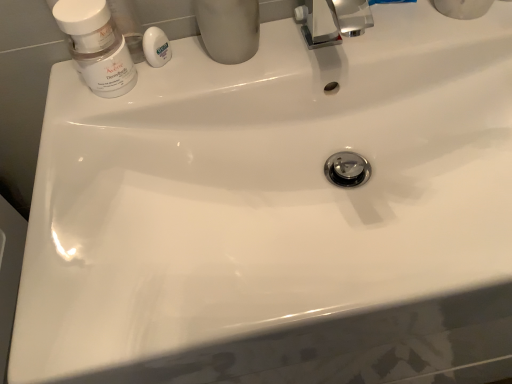
This screenshot has height=384, width=512. In order to click on white glossy soap at upper center in this screenshot , I will do `click(156, 47)`.

This screenshot has height=384, width=512. Describe the element at coordinates (228, 28) in the screenshot. I see `matte gray cup at upper center` at that location.

Consider the image. Measure the distance between matte white jar at upper left and camera.

The distance of matte white jar at upper left from camera is 17.71 inches.

I want to click on white glossy soap at upper center, so click(156, 47).

From the image's perspective, relative to matte gray cup at upper center, is white glossy soap at upper center above or below?

From the image's perspective, white glossy soap at upper center appears below matte gray cup at upper center.

Is white glossy soap at upper center touching matte gray cup at upper center?

Yes, the surface of white glossy soap at upper center is in contact with matte gray cup at upper center.

Considering the positions of points (170, 56) and (243, 9), is point (170, 56) closer to camera compared to point (243, 9)?

No.

Looking at the image, does matte white jar at upper left seem bigger or smaller compared to white glossy soap at upper center?

In the image, matte white jar at upper left appears to be larger than white glossy soap at upper center.

Is matte white jar at upper left taller or shorter than white glossy soap at upper center?

Clearly, matte white jar at upper left is taller compared to white glossy soap at upper center.

Considering the positions of objects matte white jar at upper left and white glossy soap at upper center in the image provided, who is behind, matte white jar at upper left or white glossy soap at upper center?

white glossy soap at upper center is more distant.

From the image's perspective, would you say matte white jar at upper left is positioned over white glossy soap at upper center?

No, from the image's perspective, matte white jar at upper left is not above white glossy soap at upper center.

Between matte gray cup at upper center and white glossy soap at upper center, which one has larger width?

With larger width is matte gray cup at upper center.

Which is more to the left, matte gray cup at upper center or white glossy soap at upper center?

Positioned to the left is white glossy soap at upper center.

How distant is matte gray cup at upper center from white glossy soap at upper center?

matte gray cup at upper center and white glossy soap at upper center are 3.52 inches apart from each other.

From the image's perspective, is matte gray cup at upper center over white glossy soap at upper center?

Yes, from the image's perspective, matte gray cup at upper center is over white glossy soap at upper center.

The height and width of the screenshot is (384, 512). Find the location of `mouthwash below the matte gray cup at upper center (from a real-world perspective)`. mouthwash below the matte gray cup at upper center (from a real-world perspective) is located at coordinates (96, 46).

Considering the sizes of objects matte gray cup at upper center and matte white jar at upper left in the image provided, who is taller, matte gray cup at upper center or matte white jar at upper left?

matte gray cup at upper center is taller.

Based on their positions, is matte gray cup at upper center located to the left or right of matte white jar at upper left?

matte gray cup at upper center is to the right of matte white jar at upper left.

Is matte gray cup at upper center in contact with matte white jar at upper left?

A: matte gray cup at upper center and matte white jar at upper left are clearly separated.

Can you confirm if white glossy soap at upper center is taller than matte white jar at upper left?

No.

From the image's perspective, relative to matte white jar at upper left, is white glossy soap at upper center above or below?

white glossy soap at upper center is above matte white jar at upper left.

Looking at their sizes, would you say matte white jar at upper left is wider or thinner than matte gray cup at upper center?

In the image, matte white jar at upper left appears to be more narrow than matte gray cup at upper center.

Is there a large distance between matte white jar at upper left and matte gray cup at upper center?

No, matte white jar at upper left is not far away from matte gray cup at upper center.

Which object is positioned more to the left, matte white jar at upper left or matte gray cup at upper center?

matte white jar at upper left is more to the left.

From the image's perspective, is matte white jar at upper left on top of matte gray cup at upper center?

No, from the image's perspective, matte white jar at upper left is not over matte gray cup at upper center.

The height and width of the screenshot is (384, 512). I want to click on toiletry located above the white glossy soap at upper center (from a real-world perspective), so click(228, 28).

Image resolution: width=512 pixels, height=384 pixels. In order to click on soap that is above the matte white jar at upper left (from the image's perspective) in this screenshot , I will do `click(156, 47)`.

From the image, which object appears to be nearer to matte white jar at upper left, matte gray cup at upper center or white glossy soap at upper center?

white glossy soap at upper center is closer to matte white jar at upper left.

Considering their positions, is matte white jar at upper left positioned closer to white glossy soap at upper center than matte gray cup at upper center?

matte white jar at upper left is positioned closer to the anchor white glossy soap at upper center.

Looking at the image, which one is located further to matte white jar at upper left, white glossy soap at upper center or matte gray cup at upper center?

Based on the image, matte gray cup at upper center appears to be further to matte white jar at upper left.

Considering their positions, is matte gray cup at upper center positioned further to white glossy soap at upper center than matte white jar at upper left?

Based on the image, matte gray cup at upper center appears to be further to white glossy soap at upper center.

Consider the image. From the image, which object appears to be farther from matte gray cup at upper center, matte white jar at upper left or white glossy soap at upper center?

matte white jar at upper left lies further to matte gray cup at upper center than the other object.

Based on their spatial positions, is white glossy soap at upper center or matte white jar at upper left further from matte gray cup at upper center?

Among the two, matte white jar at upper left is located further to matte gray cup at upper center.

Identify the location of soap between matte white jar at upper left and matte gray cup at upper center from left to right. Image resolution: width=512 pixels, height=384 pixels. (156, 47).